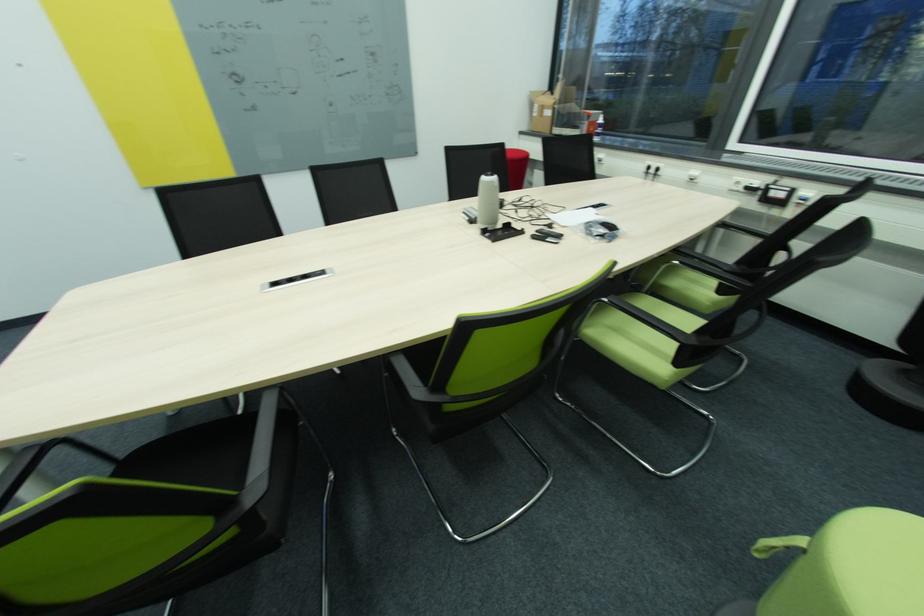
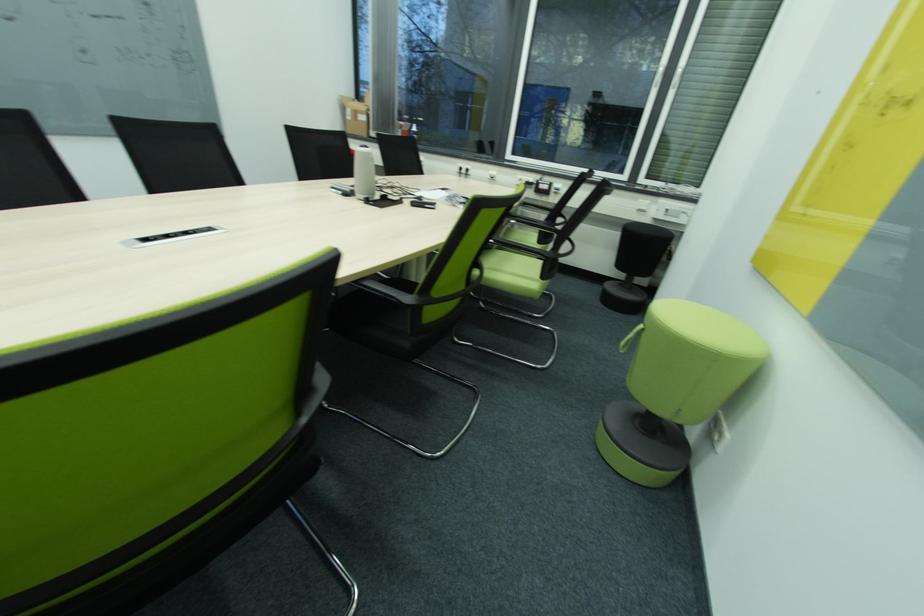
Question: The camera is either moving clockwise (left) or counter-clockwise (right) around the object. The first image is from the beginning of the video and the second image is from the end. Is the camera moving left or right when shooting the video?

Choices:
 (A) Left
 (B) Right

Answer: (A)